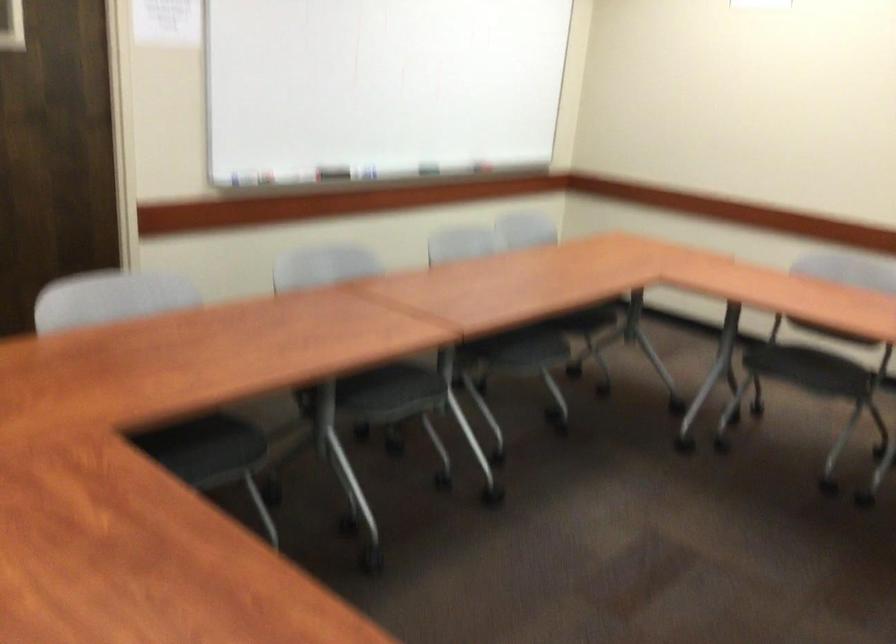
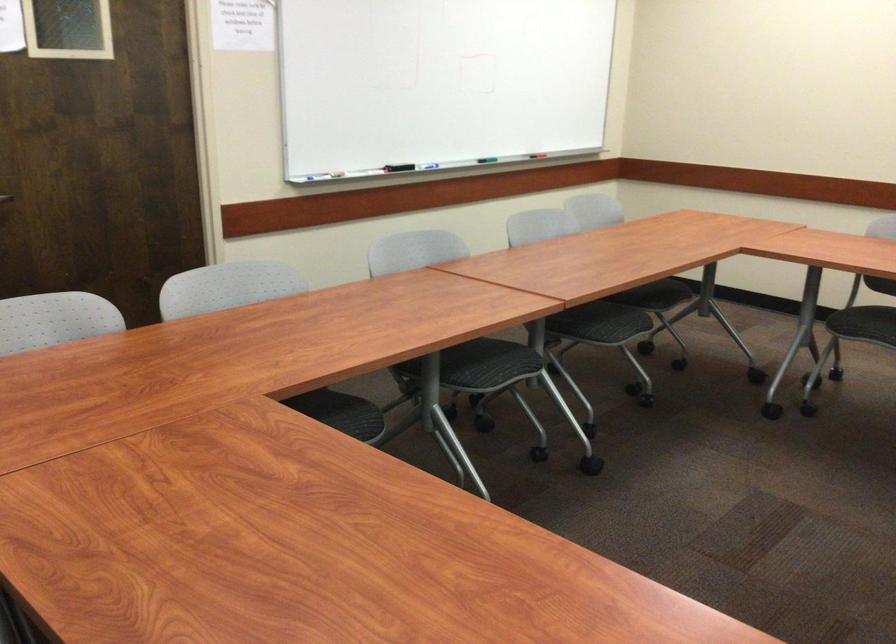
In the second image, find the point that corresponds to (382,91) in the first image.

(438, 82)